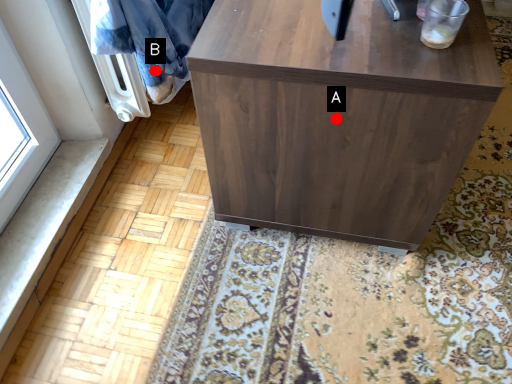
Question: Two points are circled on the image, labeled by A and B beside each circle. Which point is farther to the camera?

Choices:
 (A) A is further
 (B) B is further

Answer: (B)